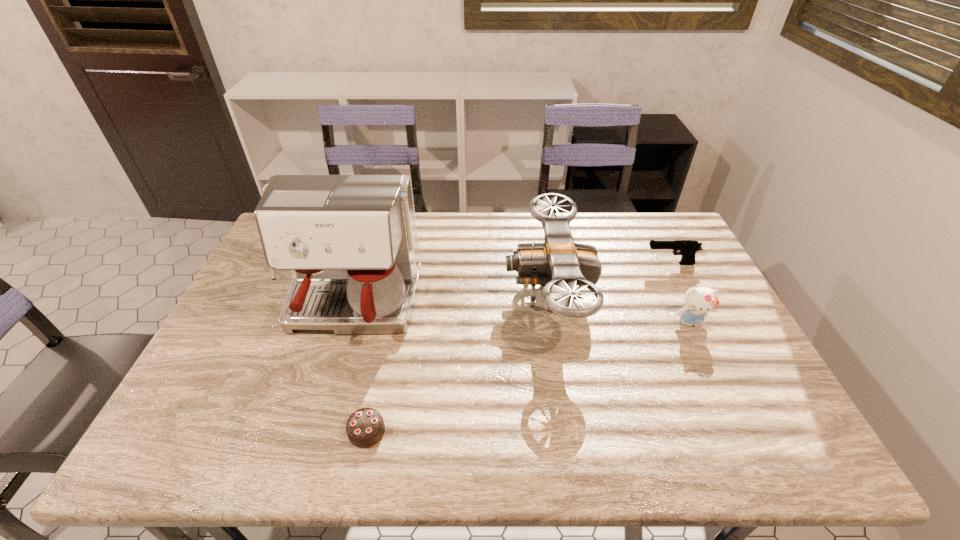
Where is `vacant space that satisfies the following two spatial constraints: 1. on the front-facing side of the pistol; 2. on the front-facing side of the kitten`? This screenshot has height=540, width=960. vacant space that satisfies the following two spatial constraints: 1. on the front-facing side of the pistol; 2. on the front-facing side of the kitten is located at coordinates (699, 322).

At what (x,y) coordinates should I click in order to perform the action: click on vacant position in the image that satisfies the following two spatial constraints: 1. on the front-facing side of the third object from right to left; 2. on the front of the coffee maker near the spout. Please return your answer as a coordinate pair (x, y). This screenshot has height=540, width=960. Looking at the image, I should click on (550, 309).

Where is `free region that satisfies the following two spatial constraints: 1. on the front of the shortest object near the spout; 2. on the left side of the coffee maker`? The image size is (960, 540). free region that satisfies the following two spatial constraints: 1. on the front of the shortest object near the spout; 2. on the left side of the coffee maker is located at coordinates (313, 431).

The height and width of the screenshot is (540, 960). Find the location of `vacant space that satisfies the following two spatial constraints: 1. on the front of the tallest object near the spout; 2. on the right side of the chocolate cake`. vacant space that satisfies the following two spatial constraints: 1. on the front of the tallest object near the spout; 2. on the right side of the chocolate cake is located at coordinates (313, 431).